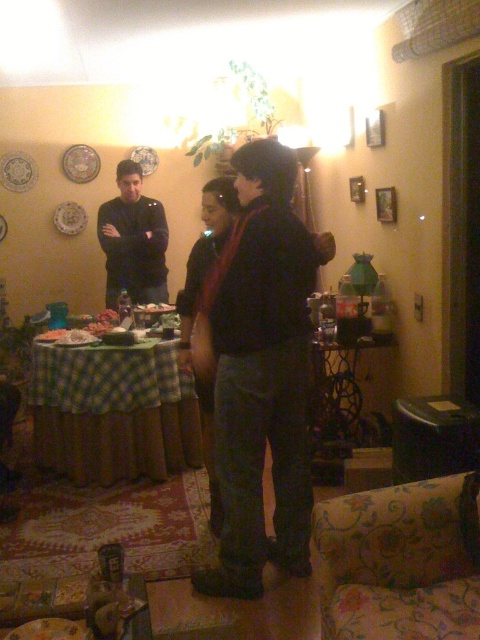
Question: Which point is farther from the camera taking this photo?

Choices:
 (A) (147, 196)
 (B) (285, 435)

Answer: (A)

Question: Which of the following is the farthest from the observer?

Choices:
 (A) [144, 296]
 (B) [224, 388]
 (C) [115, 369]

Answer: (A)

Question: Does green checkered tablecloth at center appear on the right side of black matte shirt at center?

Choices:
 (A) no
 (B) yes

Answer: (B)

Question: Is dark gray pants at center wider than black matte shirt at center?

Choices:
 (A) yes
 (B) no

Answer: (A)

Question: Which of the following is the farthest from the observer?

Choices:
 (A) (105, 230)
 (B) (271, 296)
 (C) (56, 419)

Answer: (A)

Question: Does dark gray pants at center have a lesser width compared to black matte shirt at center?

Choices:
 (A) no
 (B) yes

Answer: (A)